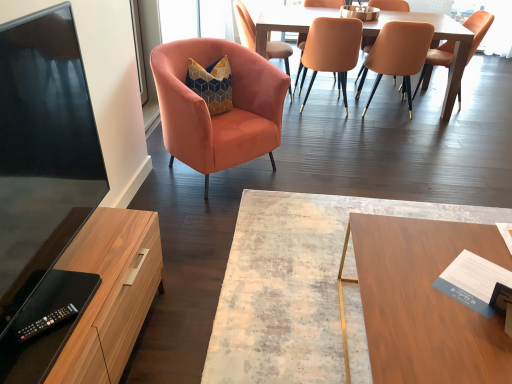
At what (x,y) coordinates should I click in order to perform the action: click on free space in front of velvet orange armchair at left, placed as the first chair when sorted from left to right. Please return your answer as a coordinate pair (x, y). The height and width of the screenshot is (384, 512). Looking at the image, I should click on coord(187,214).